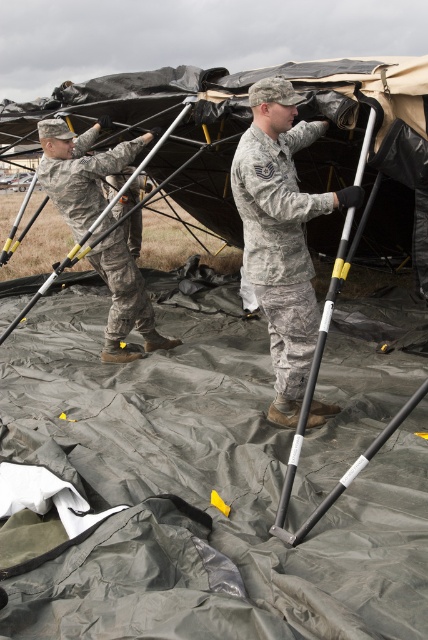
You are a military medic who needs to reach the camouflage fabric uniform at left to provide first aid. The camouflage fabric uniform at center is blocking your path. Can you safely navigate around them without getting too close?

The camouflage fabric uniform at center is 5.38 feet away from camouflage fabric uniform at left. Since the distance between them is over 5 feet, you can safely navigate around the camouflage fabric uniform at center to reach the camouflage fabric uniform at left without getting too close.

You are a photographer trying to capture a photo of the two individuals in the scene. You want to ensure both the camouflage fabric uniform at center and the camouflage fabric uniform at left are clearly visible in the frame. Based on their positions, which one should you focus on first to ensure proper alignment?

The camouflage fabric uniform at left should be focused on first since it is positioned to the left of the camouflage fabric uniform at center, allowing you to adjust the frame to include both properly.